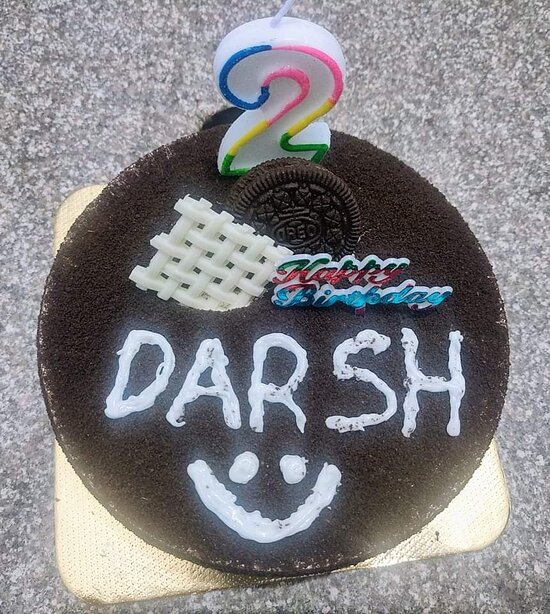
Find the location of `2 candle`. 2 candle is located at coordinates (302, 105).